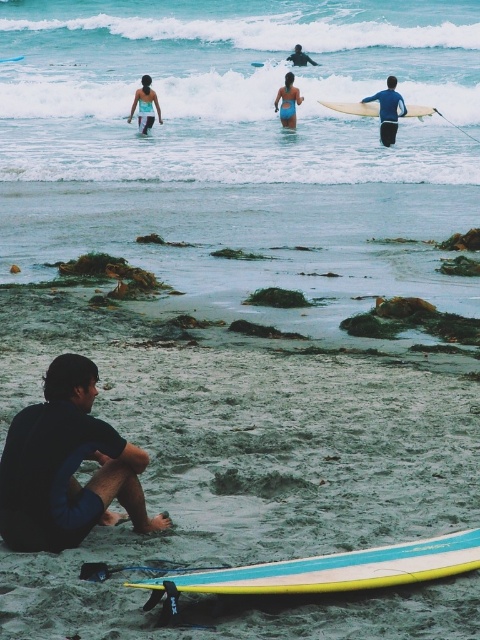
You are a photographer standing on the beach and want to capture a photo of the matte blue swimsuit at upper center and the blue glossy surfboard at lower center. If you want the surfboard to appear larger in the photo than the swimsuit, where should you position the camera relative to each object?

The matte blue swimsuit at upper center is much taller than the blue glossy surfboard at lower center. To make the surfboard appear larger in the photo, you should move closer to the blue glossy surfboard at lower center while moving farther away from the matte blue swimsuit at upper center.

You are a photographer standing on the beach and want to capture both the yellow foam surfboard at upper right and the blue wetsuit surfboard at upper center in a single shot. Which surfboard will appear smaller in your photo?

The yellow foam surfboard at upper right will appear smaller in the photo because it is not as tall as the blue wetsuit surfboard at upper center.

You are a photographer standing on the beach and want to take a photo of the blue fabric swimsuit at center and the blue glossy surfboard at lower center. Which object will appear closer to the camera in the photo?

The blue fabric swimsuit at center will appear closer to the camera in the photo because it is positioned in front of the blue glossy surfboard at lower center.